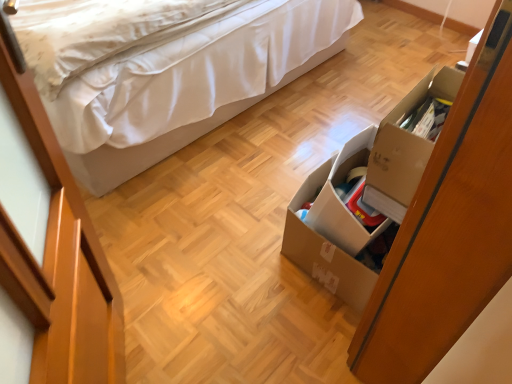
The width and height of the screenshot is (512, 384). Describe the element at coordinates (449, 228) in the screenshot. I see `cardboard box at right` at that location.

Where is `brown cardboard box at lower right`? The width and height of the screenshot is (512, 384). brown cardboard box at lower right is located at coordinates (368, 190).

The width and height of the screenshot is (512, 384). I want to click on cardboard box at right, so click(449, 228).

Can we say cardboard box at right lies outside white fabric bed at upper left?

Absolutely, cardboard box at right is external to white fabric bed at upper left.

Identify the location of bed behind the cardboard box at right. The height and width of the screenshot is (384, 512). (174, 135).

Can you confirm if cardboard box at right is bigger than white fabric bed at upper left?

Incorrect, cardboard box at right is not larger than white fabric bed at upper left.

Between cardboard box at right and white fabric bed at upper left, which one has larger width?

white fabric bed at upper left.

Which is in front, white fabric bed at upper left or cardboard box at right?

cardboard box at right is in front.

Can you confirm if white fabric bed at upper left is positioned to the right of cardboard box at right?

No.

Which object is wider, white fabric bed at upper left or cardboard box at right?

white fabric bed at upper left.

Are white fabric bed at upper left and brown cardboard box at lower right beside each other?

white fabric bed at upper left is not next to brown cardboard box at lower right, and they're not touching.

Is white fabric bed at upper left turned away from brown cardboard box at lower right?

No, white fabric bed at upper left's orientation is not away from brown cardboard box at lower right.

Locate an element on the screen. The height and width of the screenshot is (384, 512). storage box located behind the white fabric bed at upper left is located at coordinates (368, 190).

Which is more to the left, white fabric bed at upper left or brown cardboard box at lower right?

white fabric bed at upper left.

From a real-world perspective, is cardboard box at right positioned under brown cardboard box at lower right based on gravity?

Incorrect, from a real-world perspective, cardboard box at right is higher than brown cardboard box at lower right.

Based on the photo, is cardboard box at right looking in the opposite direction of brown cardboard box at lower right?

cardboard box at right does not have its back to brown cardboard box at lower right.

Consider the image. In the image, is cardboard box at right on the left side or the right side of brown cardboard box at lower right?

In the image, cardboard box at right appears on the right side of brown cardboard box at lower right.

Where is `storage box located behind the cardboard box at right`? The width and height of the screenshot is (512, 384). storage box located behind the cardboard box at right is located at coordinates (368, 190).

You are a GUI agent. You are given a task and a screenshot of the screen. Output one action in this format:
    pyautogui.click(x=<x>, y=<y>)
    Task: Click on the storage box below the cardboard box at right (from a real-world perspective)
    
    Given the screenshot: What is the action you would take?
    pyautogui.click(x=368, y=190)

In the image, is brown cardboard box at lower right on the left side or the right side of cardboard box at right?

In the image, brown cardboard box at lower right appears on the left side of cardboard box at right.

From a real-world perspective, is brown cardboard box at lower right positioned above or below cardboard box at right?

In terms of real-world spatial position, brown cardboard box at lower right is below cardboard box at right.

From the image's perspective, does brown cardboard box at lower right appear higher than cardboard box at right?

No.

Is brown cardboard box at lower right far away from white fabric bed at upper left?

That's not correct — brown cardboard box at lower right is a little close to white fabric bed at upper left.

Which of these two, brown cardboard box at lower right or white fabric bed at upper left, stands taller?

white fabric bed at upper left.

From the image's perspective, relative to white fabric bed at upper left, is brown cardboard box at lower right above or below?

brown cardboard box at lower right is situated lower than white fabric bed at upper left in the image.

Is brown cardboard box at lower right aimed at white fabric bed at upper left?

Yes.

This screenshot has height=384, width=512. I want to click on bed to the left of cardboard box at right, so click(174, 135).

Locate an element on the screen. This screenshot has width=512, height=384. dresser lying in front of the white fabric bed at upper left is located at coordinates (449, 228).

Estimate the real-world distances between objects in this image. Which object is further from white fabric bed at upper left, brown cardboard box at lower right or cardboard box at right?

The object further to white fabric bed at upper left is cardboard box at right.

Looking at the image, which one is located closer to brown cardboard box at lower right, white fabric bed at upper left or cardboard box at right?

Based on the image, cardboard box at right appears to be nearer to brown cardboard box at lower right.

Estimate the real-world distances between objects in this image. Which object is further from cardboard box at right, white fabric bed at upper left or brown cardboard box at lower right?

white fabric bed at upper left is further to cardboard box at right.

From the image, which object appears to be farther from brown cardboard box at lower right, cardboard box at right or white fabric bed at upper left?

white fabric bed at upper left is further to brown cardboard box at lower right.

Based on their spatial positions, is cardboard box at right or brown cardboard box at lower right further from white fabric bed at upper left?

cardboard box at right lies further to white fabric bed at upper left than the other object.

From the image, which object appears to be farther from cardboard box at right, brown cardboard box at lower right or white fabric bed at upper left?

The object further to cardboard box at right is white fabric bed at upper left.

Identify the location of dresser between white fabric bed at upper left and brown cardboard box at lower right vertically. [x=449, y=228].